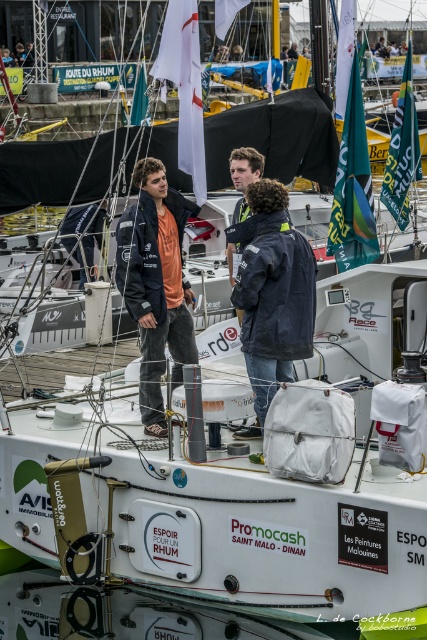
Between matte black jacket at center and matte orange shirt at center, which one appears on the left side from the viewer's perspective?

From the viewer's perspective, matte black jacket at center appears more on the left side.

Is matte black jacket at center to the left of matte orange shirt at center from the viewer's perspective?

Yes, matte black jacket at center is to the left of matte orange shirt at center.

Is point (286, 225) closer to viewer compared to point (155, 240)?

Yes.

Where is `matte black jacket at center`? This screenshot has height=640, width=427. matte black jacket at center is located at coordinates (155, 284).

Consider the image. Can you confirm if matte orange shirt at center is bigger than dark blue jacket at center?

Correct, matte orange shirt at center is larger in size than dark blue jacket at center.

Is matte orange shirt at center above dark blue jacket at center?

No, matte orange shirt at center is not above dark blue jacket at center.

You are a GUI agent. You are given a task and a screenshot of the screen. Output one action in this format:
    pyautogui.click(x=<x>, y=<y>)
    Task: Click on the matte orange shirt at center
    The width and height of the screenshot is (427, 640).
    Given the screenshot: What is the action you would take?
    pos(155,284)

The height and width of the screenshot is (640, 427). Identify the location of matte orange shirt at center. (155, 284).

Which is more to the right, matte black jacket at center or dark blue jacket at center?

From the viewer's perspective, dark blue jacket at center appears more on the right side.

Who is more distant from viewer, (155, 336) or (292, 241)?

Point (155, 336)

The height and width of the screenshot is (640, 427). I want to click on matte black jacket at center, so click(x=155, y=284).